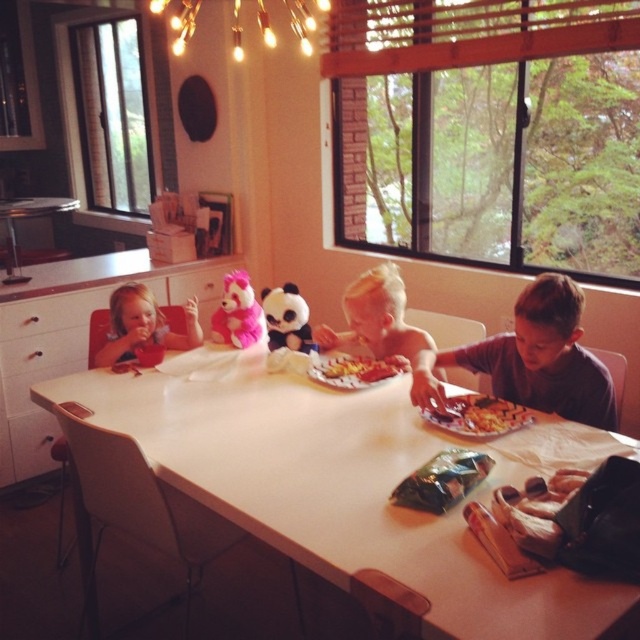
Question: Among these points, which one is nearest to the camera?

Choices:
 (A) (496, 342)
 (B) (486, 424)

Answer: (B)

Question: Is brown cotton shirt at center in front of golden crispy fries at center?

Choices:
 (A) no
 (B) yes

Answer: (A)

Question: Which object is positioned closest to the yellow paper plate at center?

Choices:
 (A) white glossy table at center
 (B) matte pink teddy bear at left

Answer: (A)

Question: Does pink plush bear at center come in front of yellow paper plate at center?

Choices:
 (A) yes
 (B) no

Answer: (B)

Question: Can you confirm if white glossy table at center is smaller than matte pink teddy bear at left?

Choices:
 (A) yes
 (B) no

Answer: (B)

Question: Estimate the real-world distances between objects in this image. Which object is farther from the warm matte string lights at upper center?

Choices:
 (A) blonde hair boy at center
 (B) matte pink teddy bear at left
 (C) white glossy table at center
 (D) matte plush panda at center

Answer: (C)